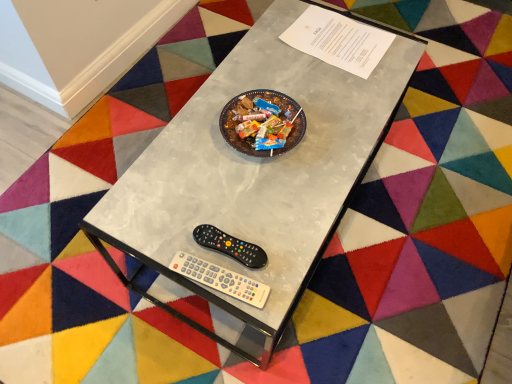
Question: Is metallic gray table at center located outside black plastic remote at lower center?

Choices:
 (A) yes
 (B) no

Answer: (A)

Question: From a real-world perspective, is metallic gray table at center over black plastic remote at lower center?

Choices:
 (A) yes
 (B) no

Answer: (B)

Question: Is metallic gray table at center at the right side of black plastic remote at lower center?

Choices:
 (A) no
 (B) yes

Answer: (B)

Question: Considering the relative positions of metallic gray table at center and black plastic remote at lower center in the image provided, is metallic gray table at center in front of black plastic remote at lower center?

Choices:
 (A) yes
 (B) no

Answer: (A)

Question: Does metallic gray table at center have a smaller size compared to black plastic remote at lower center?

Choices:
 (A) yes
 (B) no

Answer: (B)

Question: Considering the relative positions of metallic gray table at center and black plastic remote at lower center in the image provided, is metallic gray table at center to the left of black plastic remote at lower center from the viewer's perspective?

Choices:
 (A) yes
 (B) no

Answer: (B)

Question: From a real-world perspective, is white plastic wii controller at lower center under black plastic remote at lower center?

Choices:
 (A) no
 (B) yes

Answer: (A)

Question: Is white plastic wii controller at lower center touching black plastic remote at lower center?

Choices:
 (A) no
 (B) yes

Answer: (B)

Question: Is white plastic wii controller at lower center taller than black plastic remote at lower center?

Choices:
 (A) yes
 (B) no

Answer: (B)

Question: Can you confirm if white plastic wii controller at lower center is thinner than black plastic remote at lower center?

Choices:
 (A) no
 (B) yes

Answer: (A)

Question: Could you tell me if white plastic wii controller at lower center is facing black plastic remote at lower center?

Choices:
 (A) no
 (B) yes

Answer: (A)

Question: Is white plastic wii controller at lower center facing away from black plastic remote at lower center?

Choices:
 (A) no
 (B) yes

Answer: (A)

Question: Is white plastic wii controller at lower center thinner than metallic gray table at center?

Choices:
 (A) no
 (B) yes

Answer: (B)